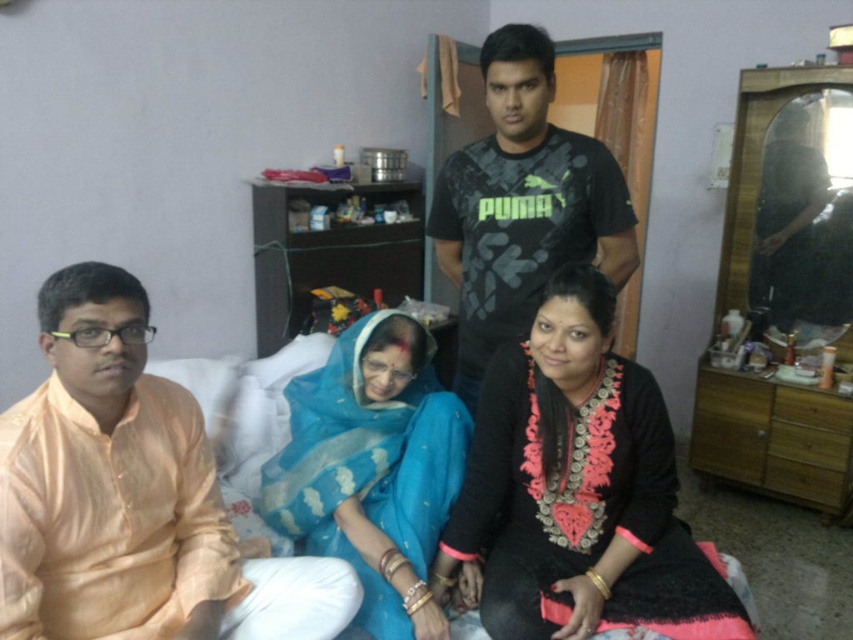
Question: Which point is closer to the camera?

Choices:
 (A) (553, 525)
 (B) (563, 163)

Answer: (A)

Question: Which point appears farthest from the camera in this image?

Choices:
 (A) (537, 246)
 (B) (671, 636)
 (C) (97, 323)

Answer: (A)

Question: Can you confirm if black lace dress at center is positioned to the left of black matte t-shirt at center?

Choices:
 (A) yes
 (B) no

Answer: (B)

Question: Is light peach silk kurta at lower left closer to camera compared to black matte t-shirt at center?

Choices:
 (A) no
 (B) yes

Answer: (B)

Question: Does light peach silk kurta at lower left have a lesser width compared to blue silk saree at center?

Choices:
 (A) no
 (B) yes

Answer: (A)

Question: Considering the real-world distances, which object is closest to the black matte t-shirt at center?

Choices:
 (A) blue silk saree at center
 (B) light peach silk kurta at lower left

Answer: (A)